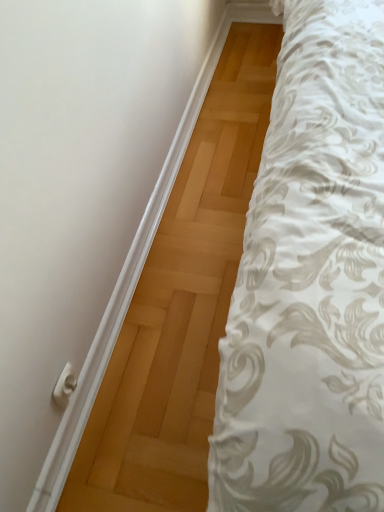
I want to click on empty space that is ontop of white matte door at upper left (from a real-world perspective), so click(x=143, y=215).